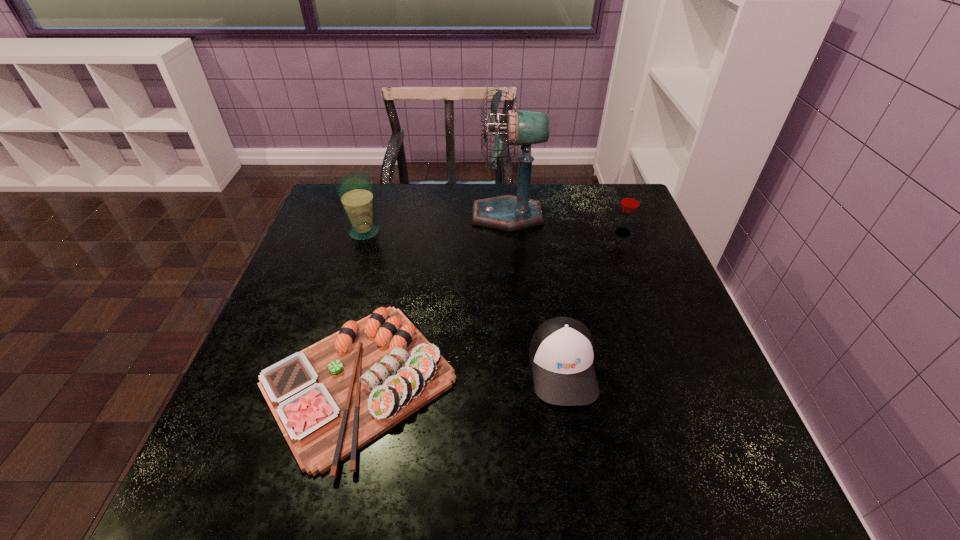
In order to click on object at the near left corner in this screenshot , I will do `click(331, 399)`.

I want to click on object at the far right corner, so point(630,202).

Locate an element on the screen. This screenshot has height=540, width=960. free space at the far edge is located at coordinates (453, 203).

In order to click on vacant space at the near edge of the desktop in this screenshot , I will do `click(550, 505)`.

You are a GUI agent. You are given a task and a screenshot of the screen. Output one action in this format:
    pyautogui.click(x=<x>, y=<y>)
    Task: Click on the vacant point at the left edge
    The height and width of the screenshot is (540, 960).
    Given the screenshot: What is the action you would take?
    pyautogui.click(x=337, y=321)

In the image, there is a desktop. Identify the location of free space at the right edge. The image size is (960, 540). (593, 234).

At what (x,y) coordinates should I click in order to perform the action: click on vacant space at the far left corner. Please return your answer as a coordinate pair (x, y). This screenshot has width=960, height=540. Looking at the image, I should click on [336, 208].

In the image, there is a desktop. Where is `free region at the near left corner`? free region at the near left corner is located at coordinates (198, 485).

Where is `vacant space at the far right corner`? vacant space at the far right corner is located at coordinates (598, 194).

The image size is (960, 540). In order to click on vacant area that lies between the tallest object and the shortest object in this screenshot , I will do `click(433, 299)`.